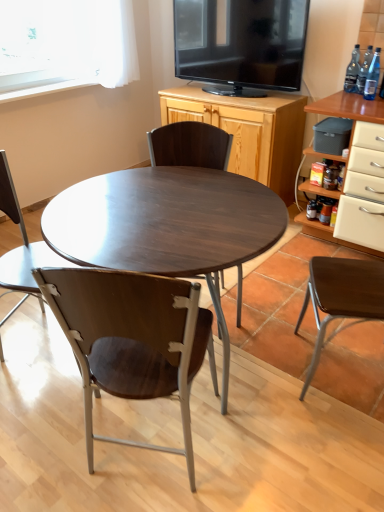
Image resolution: width=384 pixels, height=512 pixels. I want to click on vacant area in front of blue glass bottle at upper right, the 3th bottle positioned from the back, so click(371, 101).